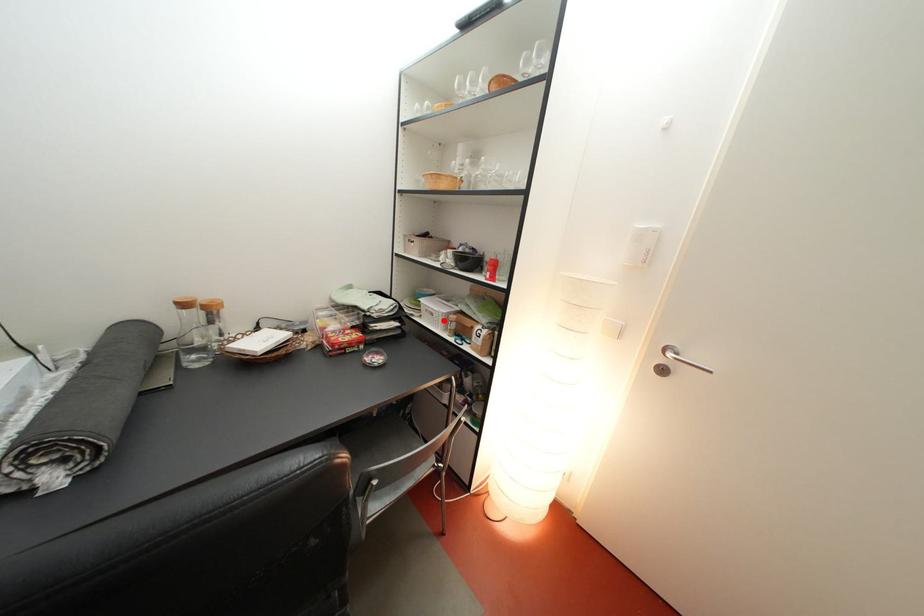
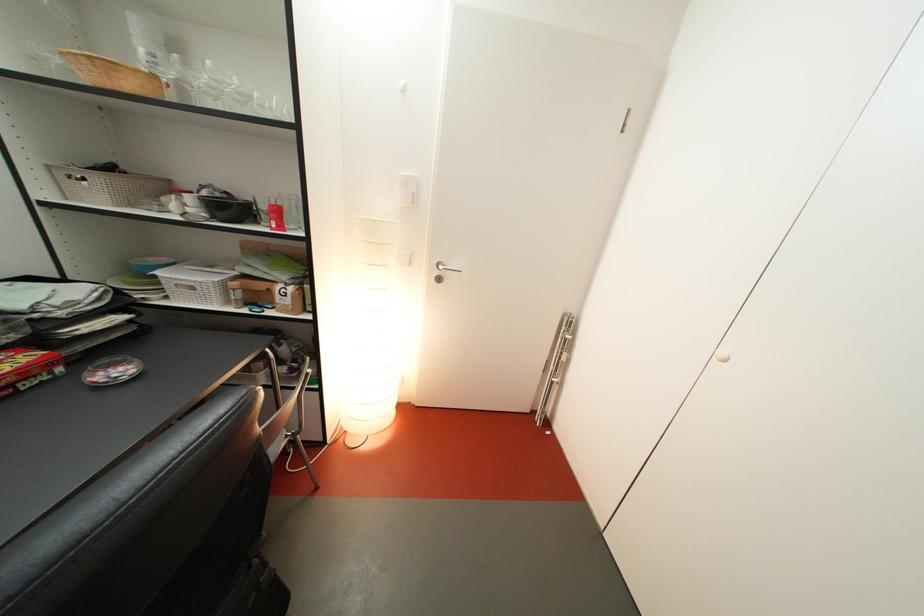
Locate, in the second image, the point that corresponds to the highlighted location in the first image.

(204, 294)